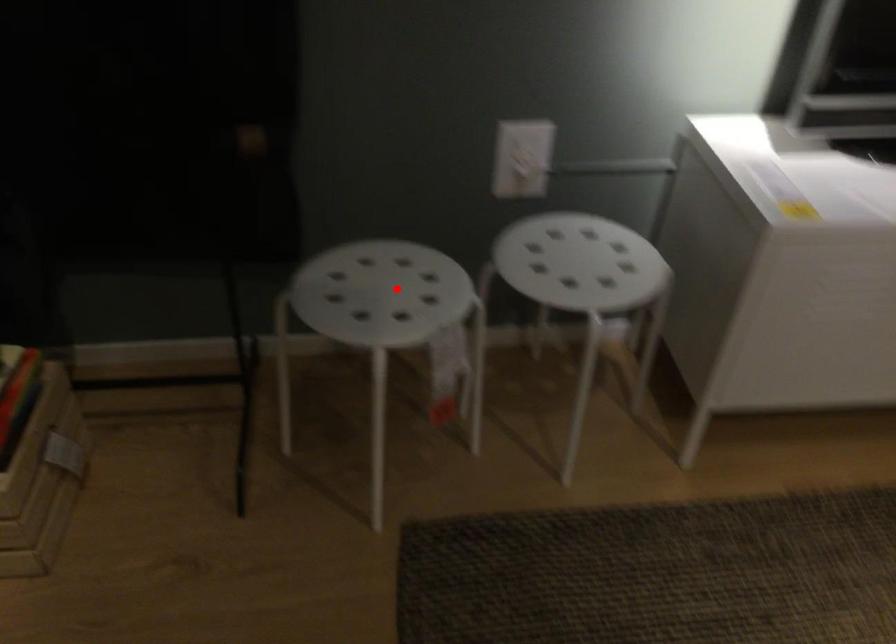
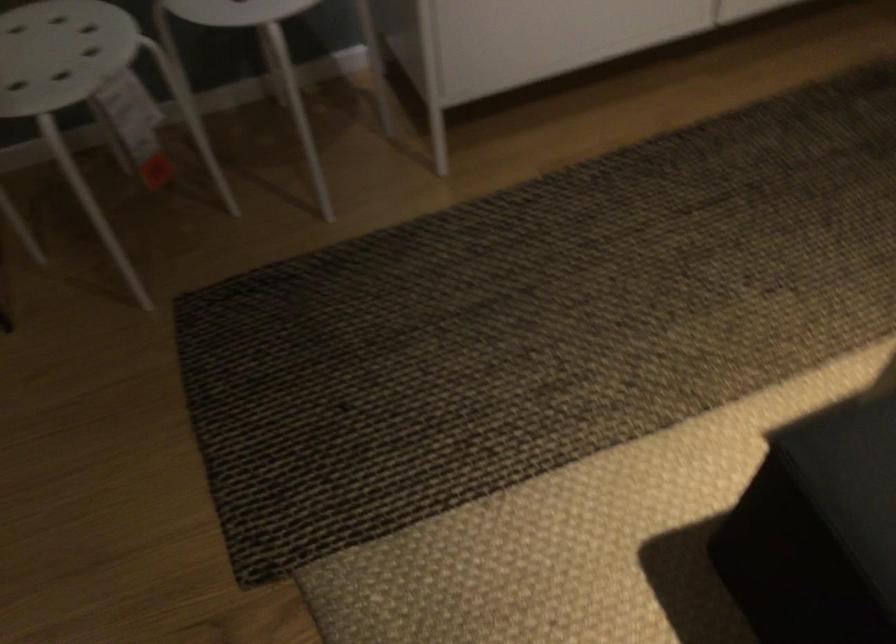
Where in the second image is the point corresponding to the highlighted location from the first image?

(61, 53)